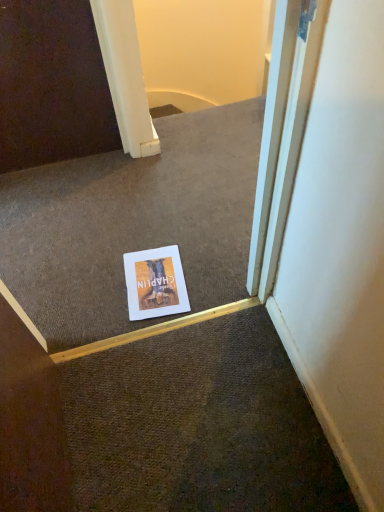
Describe the element at coordinates (155, 283) in the screenshot. The image size is (384, 512). I see `white paper at center` at that location.

Where is `white paper at center`? The width and height of the screenshot is (384, 512). white paper at center is located at coordinates (155, 283).

The image size is (384, 512). Identify the location of white paper at center. (155, 283).